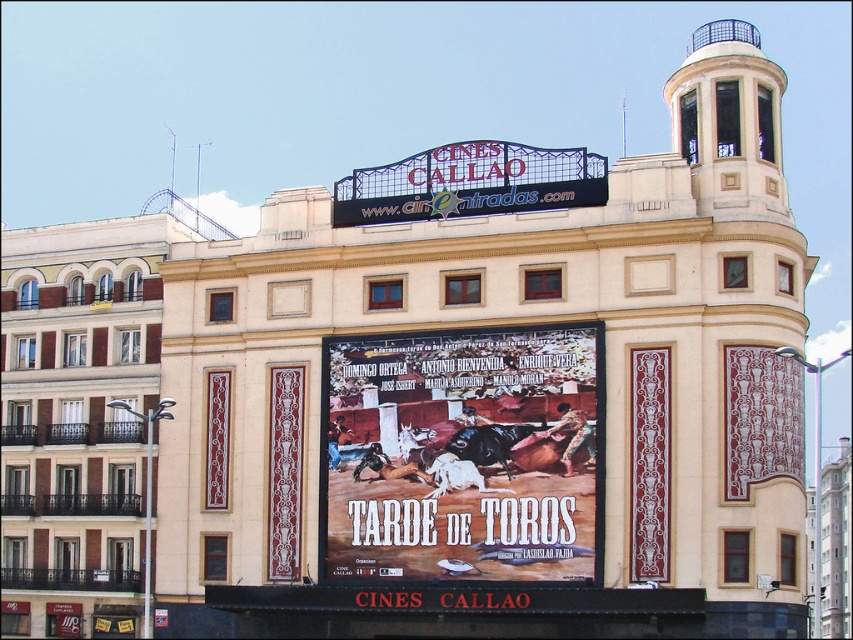
Measure the distance between matte poster at center and camera.

matte poster at center is 61.89 meters away from camera.

Does matte poster at center appear under metallic signboard at center?

Yes, matte poster at center is below metallic signboard at center.

Is point (437, 522) positioned after point (550, 195)?

No, it is in front of (550, 195).

Where is `matte poster at center`? The height and width of the screenshot is (640, 853). matte poster at center is located at coordinates (463, 456).